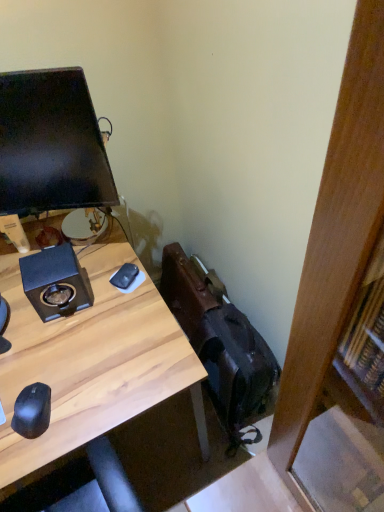
Where is `free space in front of black matte mouse at center, the first mouse when ordered from top to bottom`? free space in front of black matte mouse at center, the first mouse when ordered from top to bottom is located at coordinates (119, 326).